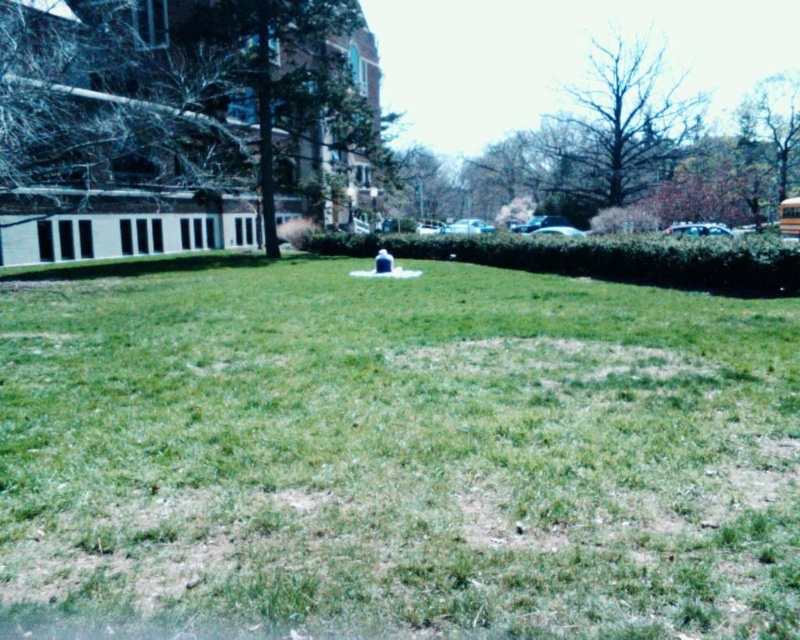
Which is more to the left, green grassy at center or yellow matte school bus at right?

green grassy at center

Who is more distant from viewer, (61, 580) or (784, 211)?

The point (784, 211) is more distant.

Where is `green grassy at center`? green grassy at center is located at coordinates (400, 451).

Find the location of `green grassy at center`. green grassy at center is located at coordinates tap(400, 451).